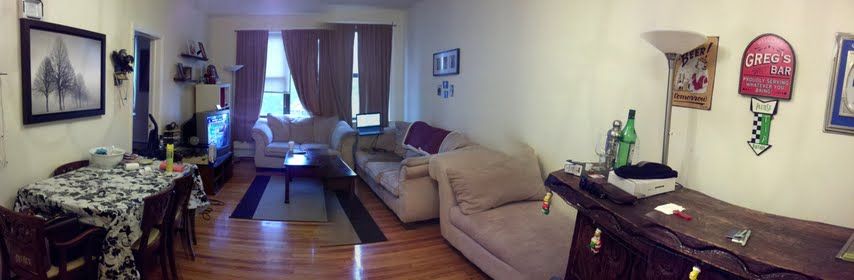
Find the location of a particular element. The width and height of the screenshot is (854, 280). living room floor is located at coordinates (284, 240).